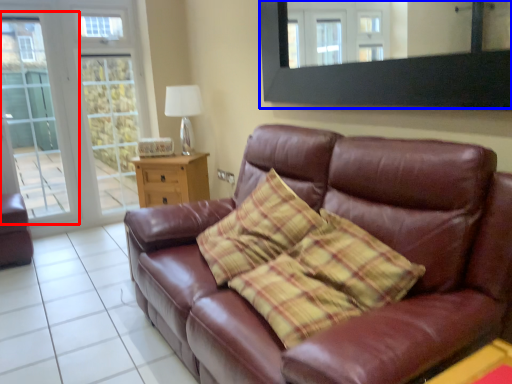
Question: Which object appears closest to the camera in this image, screen door (highlighted by a red box) or mirror (highlighted by a blue box)?

Choices:
 (A) screen door
 (B) mirror

Answer: (B)